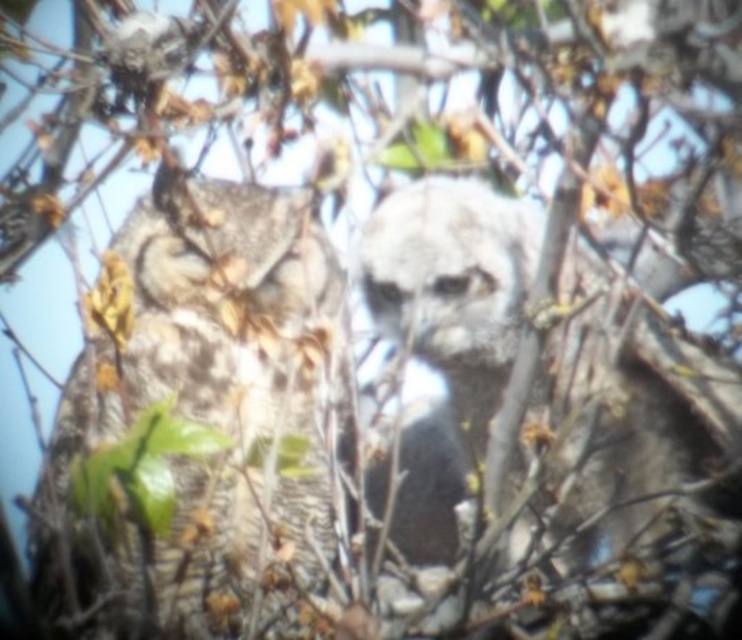
Which of these two, speckled feathered owl at center or fuzzy white owl at center, stands shorter?

A: fuzzy white owl at center is shorter.

Image resolution: width=742 pixels, height=640 pixels. What do you see at coordinates (200, 422) in the screenshot?
I see `speckled feathered owl at center` at bounding box center [200, 422].

Is point (303, 524) positioned after point (610, 344)?

Yes.

Locate an element on the screen. speckled feathered owl at center is located at coordinates (200, 422).